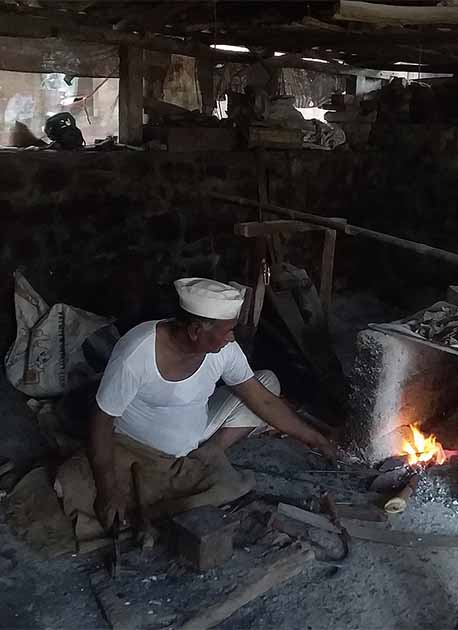
At what (x,y) coordinates should I click in order to perform the action: click on curtain. Please return your answer as a coordinate pair (x, y). Looking at the image, I should click on (73, 57), (185, 76), (239, 77), (318, 84).